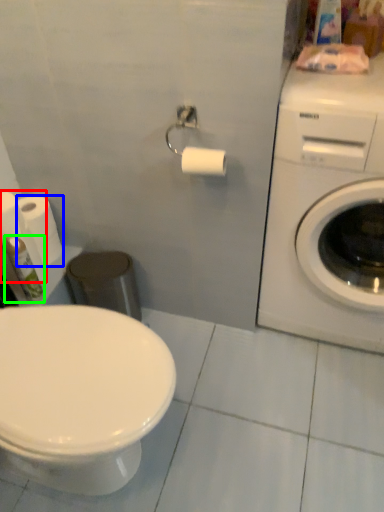
Question: Considering the real-world distances, which object is closest to toilet paper (highlighted by a red box)? toilet paper (highlighted by a blue box) or toiletry (highlighted by a green box).

Choices:
 (A) toilet paper
 (B) toiletry

Answer: (B)